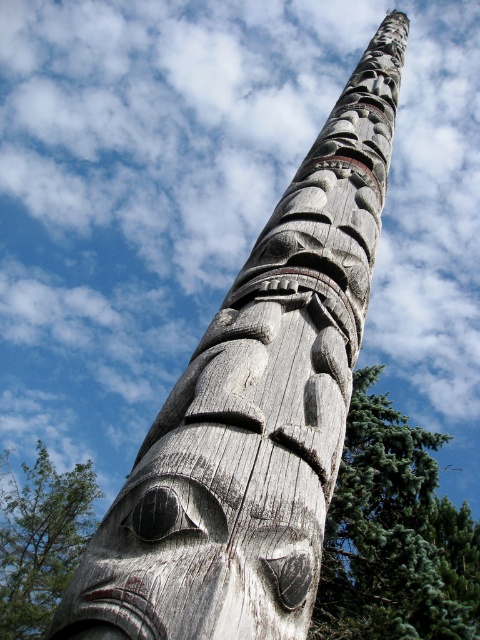
Does point (49, 612) lie behind point (94, 490)?

No, (49, 612) is closer to viewer.

Does gray wood totem pole at center have a larger size compared to green textured tree at lower left?

Correct, gray wood totem pole at center is larger in size than green textured tree at lower left.

Does point (468, 577) lie behind point (0, 516)?

No, (468, 577) is closer to viewer.

Locate an element on the screen. gray wood totem pole at center is located at coordinates (395, 534).

Who is positioned more to the left, green needle-like tree at center or green textured tree at lower left?

green textured tree at lower left is more to the left.

Where is `green needle-like tree at center`? green needle-like tree at center is located at coordinates (394, 534).

Is gray wood totem pole at center to the left of green needle-like tree at center from the viewer's perspective?

Yes, gray wood totem pole at center is to the left of green needle-like tree at center.

Is gray wood totem pole at center behind green needle-like tree at center?

Yes, it is.

Describe the element at coordinates (395, 534) in the screenshot. I see `gray wood totem pole at center` at that location.

Identify the location of gray wood totem pole at center. (395, 534).